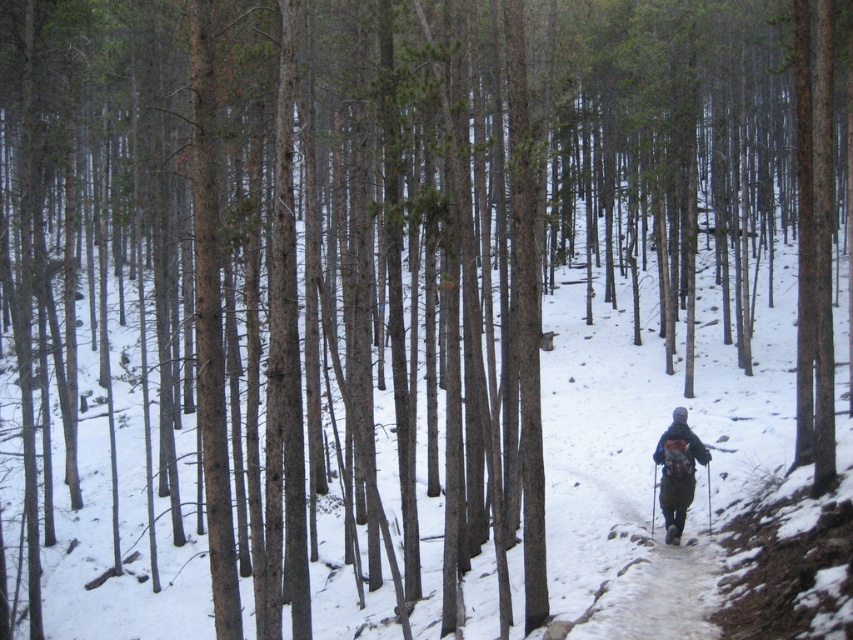
Does point (647, 608) lie behind point (689, 449)?

No, it is in front of (689, 449).

Between snowy dirt path at center and dark gray backpack at center, which one has more height?

With more height is dark gray backpack at center.

Which is in front, point (703, 577) or point (683, 406)?

Point (703, 577)

Identify the location of snowy dirt path at center. (653, 577).